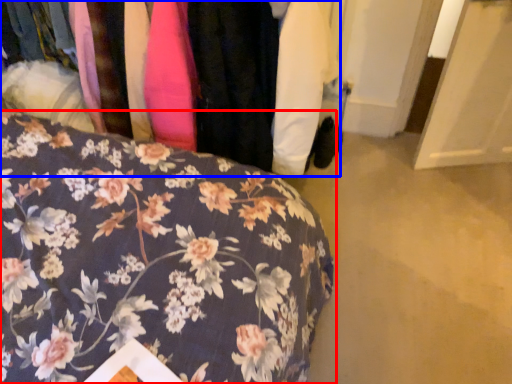
Question: Which point is closer to the camera, furniture (highlighted by a red box) or closet (highlighted by a blue box)?

Choices:
 (A) furniture
 (B) closet

Answer: (A)